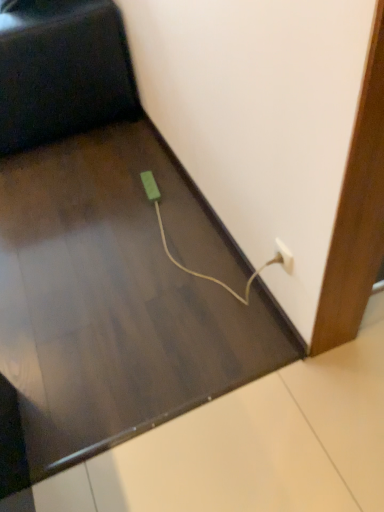
Question: Would you say white plastic plug at lower right is to the left or to the right of green matte plug at lower center in the picture?

Choices:
 (A) right
 (B) left

Answer: (A)

Question: Is white plastic plug at lower right bigger or smaller than green matte plug at lower center?

Choices:
 (A) big
 (B) small

Answer: (B)

Question: Estimate the real-world distances between objects in this image. Which object is closer to the black matte chair at upper left?

Choices:
 (A) green matte plug at lower center
 (B) white plastic plug at lower right

Answer: (A)

Question: Which object is the farthest from the white plastic plug at lower right?

Choices:
 (A) green matte plug at lower center
 (B) black matte chair at upper left

Answer: (B)